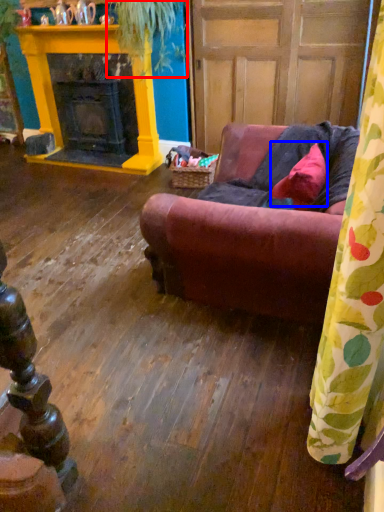
Question: Which of the following is the closest to the observer, plant (highlighted by a red box) or pillow (highlighted by a blue box)?

Choices:
 (A) plant
 (B) pillow

Answer: (B)